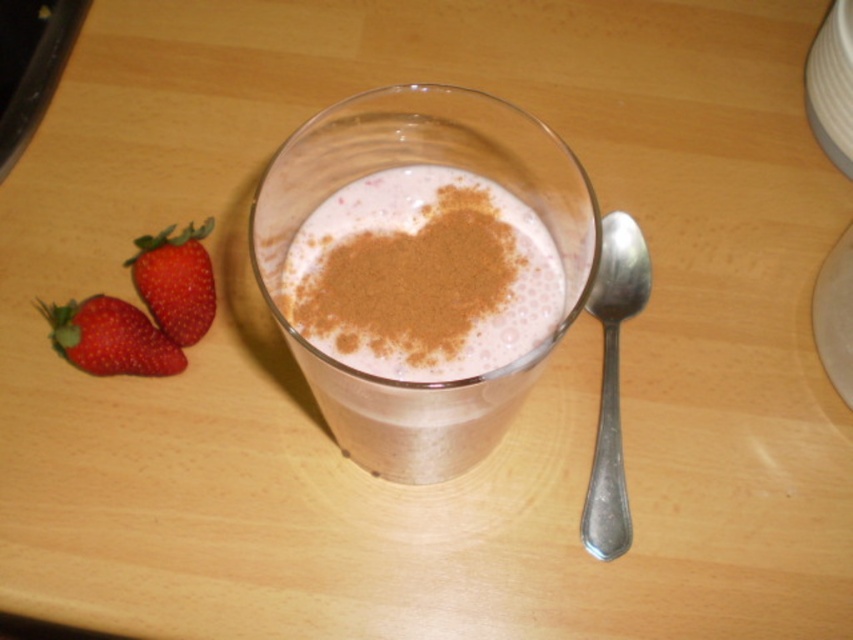
Does smoothie with cinnamon at center have a larger size compared to silver metallic spoon at right?

Correct, smoothie with cinnamon at center is larger in size than silver metallic spoon at right.

Is smoothie with cinnamon at center thinner than silver metallic spoon at right?

No.

Is point (467, 310) positioned after point (630, 269)?

No.

The width and height of the screenshot is (853, 640). Identify the location of smoothie with cinnamon at center. (421, 321).

Between red matte strawberry at left and red glossy strawberry at lower left, which one has less height?

With less height is red matte strawberry at left.

Find the location of a particular element. This screenshot has width=853, height=640. red matte strawberry at left is located at coordinates (109, 339).

This screenshot has height=640, width=853. In order to click on red matte strawberry at left in this screenshot , I will do `click(109, 339)`.

Can you confirm if smoothie with cinnamon at center is positioned to the left of red glossy strawberry at lower left?

Incorrect, smoothie with cinnamon at center is not on the left side of red glossy strawberry at lower left.

Is smoothie with cinnamon at center to the right of red glossy strawberry at lower left from the viewer's perspective?

Indeed, smoothie with cinnamon at center is positioned on the right side of red glossy strawberry at lower left.

What do you see at coordinates (421, 321) in the screenshot?
I see `smoothie with cinnamon at center` at bounding box center [421, 321].

You are a GUI agent. You are given a task and a screenshot of the screen. Output one action in this format:
    pyautogui.click(x=<x>, y=<y>)
    Task: Click on the smoothie with cinnamon at center
    The image size is (853, 640).
    Given the screenshot: What is the action you would take?
    pyautogui.click(x=421, y=321)